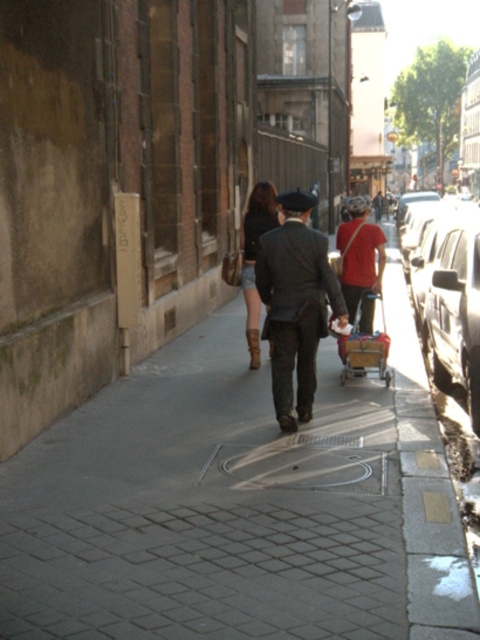
Looking at this image, can you confirm if matte black coat at center is smaller than matte red shirt at center?

Yes.

Which is below, matte black coat at center or matte red shirt at center?

matte black coat at center is lower down.

You are a GUI agent. You are given a task and a screenshot of the screen. Output one action in this format:
    pyautogui.click(x=<x>, y=<y>)
    Task: Click on the matte black coat at center
    This screenshot has height=640, width=480.
    Given the screenshot: What is the action you would take?
    pyautogui.click(x=296, y=304)

Find the location of a particular element. matte black coat at center is located at coordinates (296, 304).

Does matte red shirt at center come in front of metallic silver shopping cart at center?

Yes, matte red shirt at center is closer to the viewer.

Which is in front, point (351, 314) or point (386, 355)?

Positioned in front is point (386, 355).

Between point (370, 244) and point (345, 339), which one is positioned behind?

Positioned behind is point (370, 244).

I want to click on matte red shirt at center, so click(x=360, y=253).

Can you confirm if shiny silver car at right is smaller than metallic silver shopping cart at center?

Incorrect, shiny silver car at right is not smaller in size than metallic silver shopping cart at center.

Does point (414, 282) come closer to viewer compared to point (368, 353)?

No.

The image size is (480, 640). I want to click on shiny silver car at right, so click(x=450, y=301).